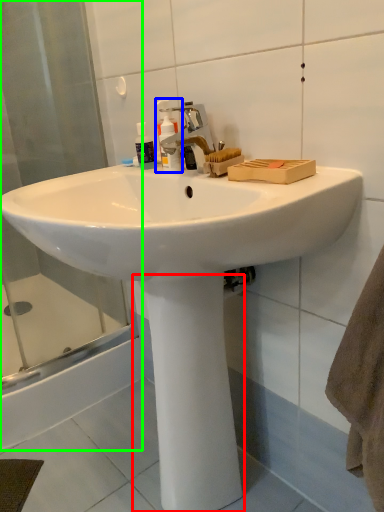
Question: Which object is the farthest from pillar (highlighted by a red box)? Choose among these: cleaning product (highlighted by a blue box) or shower door (highlighted by a green box).

Choices:
 (A) cleaning product
 (B) shower door

Answer: (B)